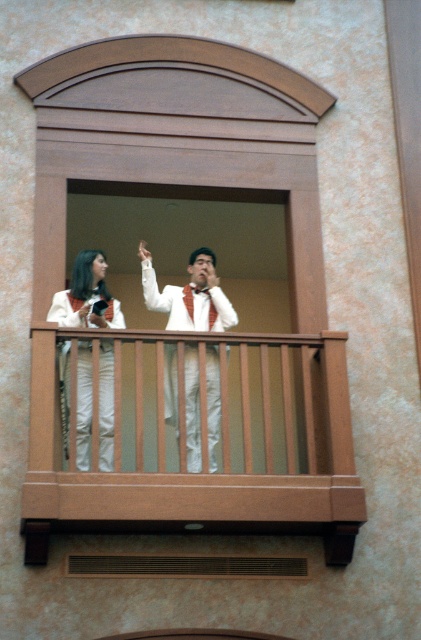
You are standing on a balcony with two people. The first person is at point [301,388]. The second person is at point 0.391, 0.285. The distance between them is 34.14 meters. If you want to place a new speaker system exactly halfway between them, where should you place it?

To place the speaker system exactly halfway between the two people, you should position it at the midpoint between point [301,388] and point 0.391, 0.285. The midpoint coordinates would be calculated by averaging the x and y values of both points. The x coordinate is 0.609 and 0.391, so the average is 0.5. The y coordinate is 0.715 and 0.285, so the average is 0.5. Therefore, the speaker system should be placed at point 0.5, 0.5.

You are a photographer positioned on the balcony. You notice the brown wooden balustrade at center and the white matte pants at center. Which object is positioned to the right when viewed from your perspective?

The brown wooden balustrade at center is to the right of the white matte pants at center, so the brown wooden balustrade at center is positioned to the right.

You are a photographer trying to capture a photo of the white matte pants at center from above. Can you position yourself above the brown wooden balcony at center to do so?

The brown wooden balcony at center is located below white matte pants at center, so yes, you can position yourself above the brown wooden balcony at center to capture the white matte pants at center from above.